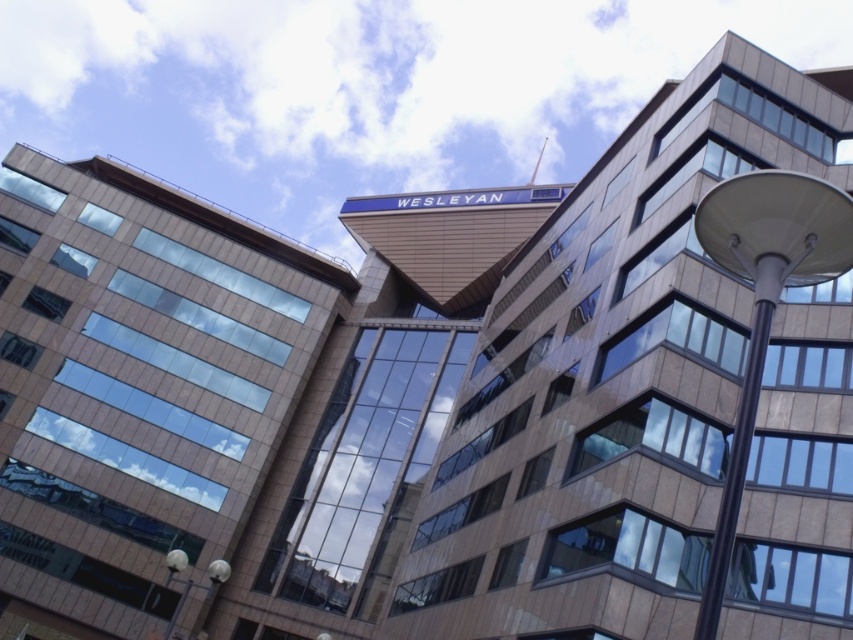
Which is behind, point (592, 518) or point (735, 440)?

The point (592, 518) is behind.

Between brown stone building at upper center and white glossy streetlight at right, which one appears on the right side from the viewer's perspective?

Positioned to the right is brown stone building at upper center.

Does point (444, 625) lie in front of point (715, 540)?

No, (444, 625) is further to viewer.

Identify the location of brown stone building at upper center. The image size is (853, 640). (612, 378).